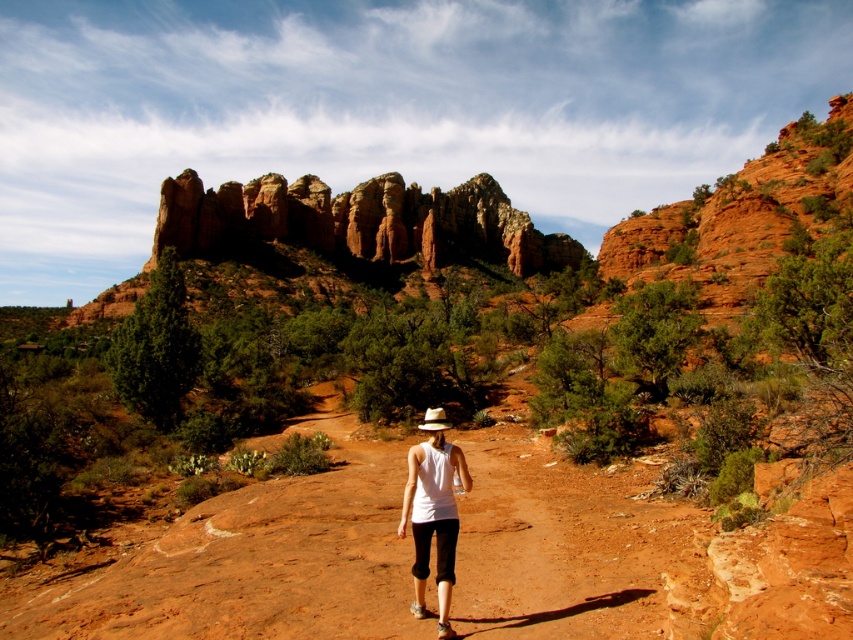
You are a hiker planning to walk along the dusty red dirt track at center. You notice the rustic sandstone rock formation at upper center nearby. Which of these two objects is wider in terms of physical dimensions?

The rustic sandstone rock formation at upper center is wider than the dusty red dirt track at center.